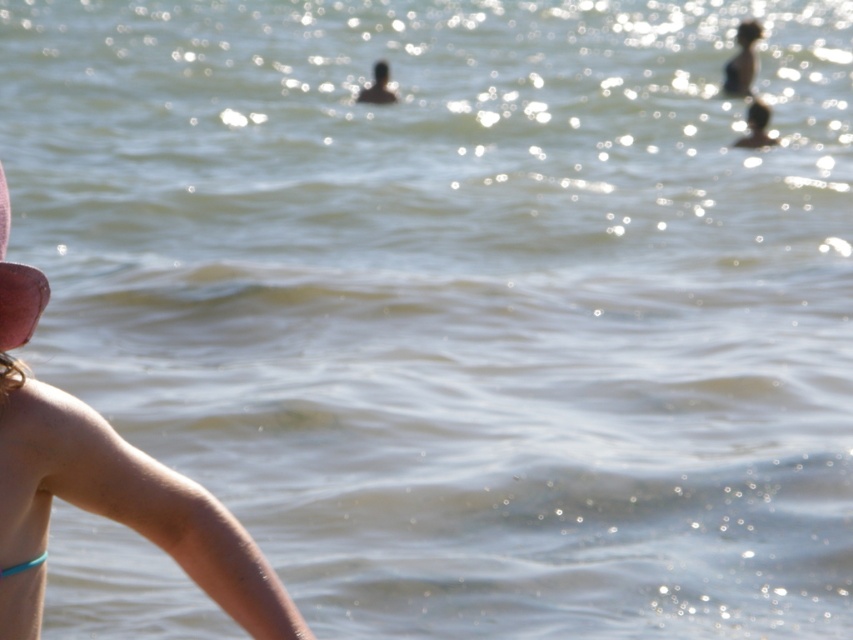
Question: Can you confirm if tan skin arm at lower left is smaller than pink fabric hat at left?

Choices:
 (A) no
 (B) yes

Answer: (A)

Question: Considering the relative positions of tan skin arm at lower left and pink fabric hat at left in the image provided, where is tan skin arm at lower left located with respect to pink fabric hat at left?

Choices:
 (A) right
 (B) left

Answer: (A)

Question: Which point is farther from the camera taking this photo?

Choices:
 (A) (134, 465)
 (B) (0, 310)

Answer: (A)

Question: Which of the following is the farthest from the observer?

Choices:
 (A) pink fabric hat at left
 (B) tan skin arm at lower left

Answer: (A)

Question: Is tan skin arm at lower left to the right of pink fabric hat at left from the viewer's perspective?

Choices:
 (A) yes
 (B) no

Answer: (A)